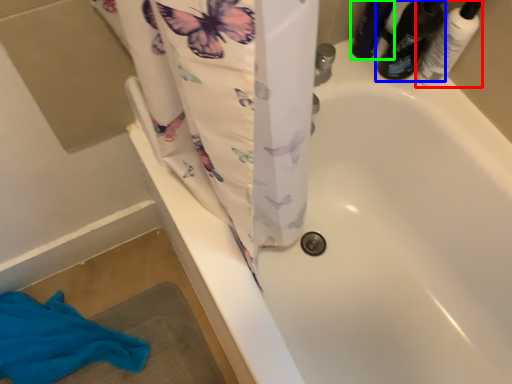
Question: Based on their relative distances, which object is farther from toiletry (highlighted by a red box)? Choose from footwear (highlighted by a blue box) and toiletry (highlighted by a green box).

Choices:
 (A) footwear
 (B) toiletry

Answer: (B)